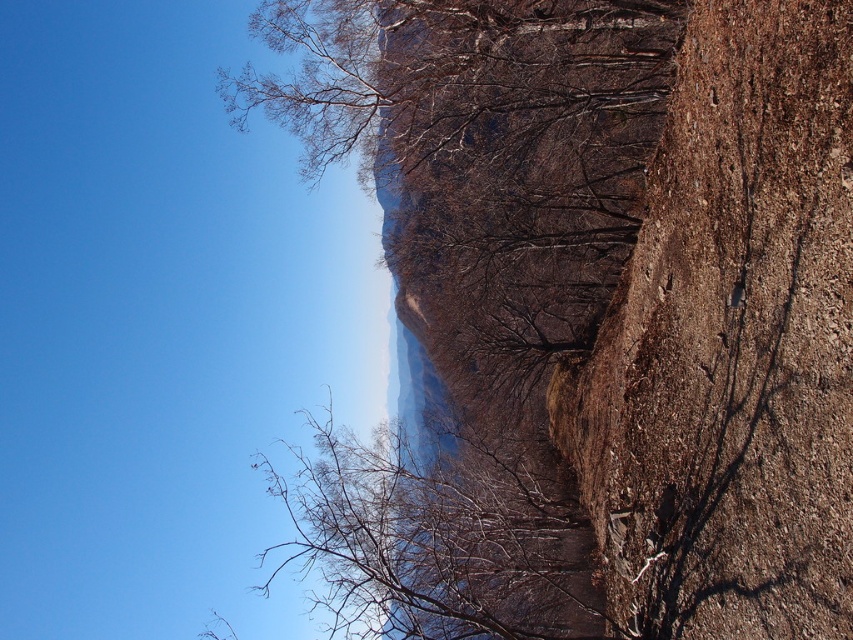
Question: Is brown rough rock at right below bare branches at center?

Choices:
 (A) no
 (B) yes

Answer: (A)

Question: Among these objects, which one is nearest to the camera?

Choices:
 (A) bare branches at center
 (B) brown rough rock at right

Answer: (B)

Question: From the image, what is the correct spatial relationship of brown rough rock at right in relation to bare branches at center?

Choices:
 (A) below
 (B) above

Answer: (B)

Question: Which point appears closest to the camera in this image?

Choices:
 (A) (593, 637)
 (B) (697, 524)

Answer: (B)

Question: Is brown rough rock at right below bare branches at center?

Choices:
 (A) no
 (B) yes

Answer: (A)